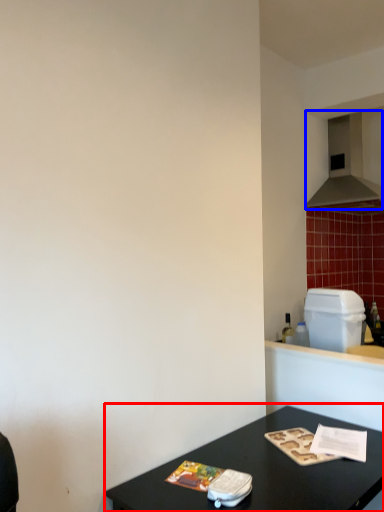
Question: Among these objects, which one is nearest to the camera, table (highlighted by a red box) or exhaust hood (highlighted by a blue box)?

Choices:
 (A) table
 (B) exhaust hood

Answer: (A)